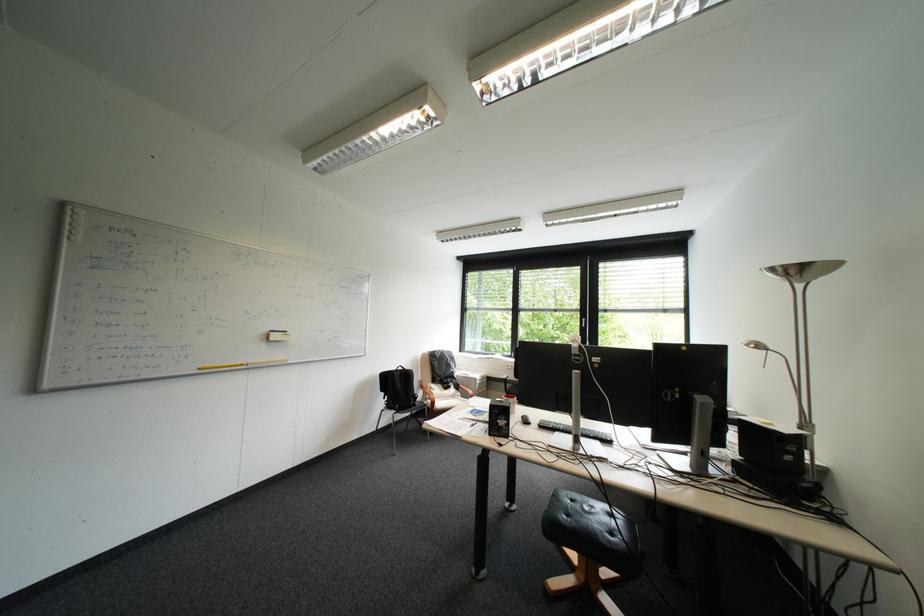
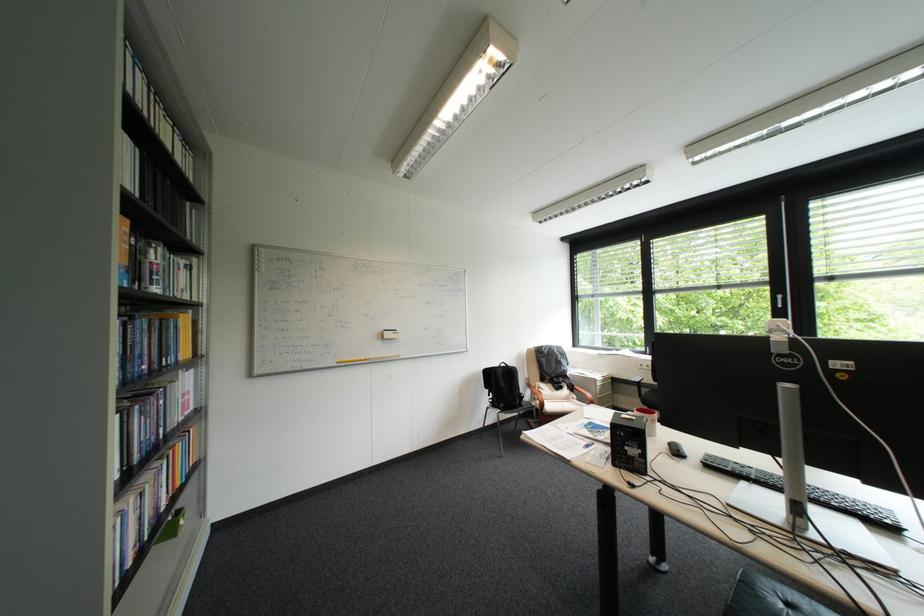
The point at (428, 392) is marked in the first image. Where is the corresponding point in the second image?

(533, 392)